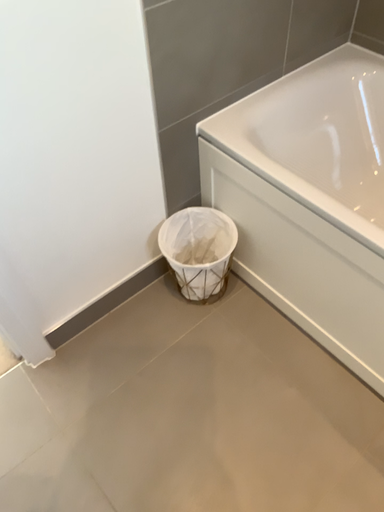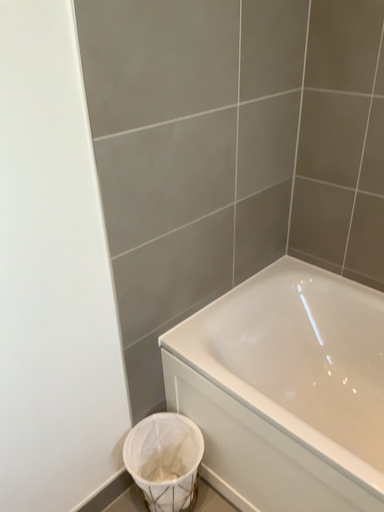
Question: How did the camera likely rotate when shooting the video?

Choices:
 (A) rotated upward
 (B) rotated downward

Answer: (A)